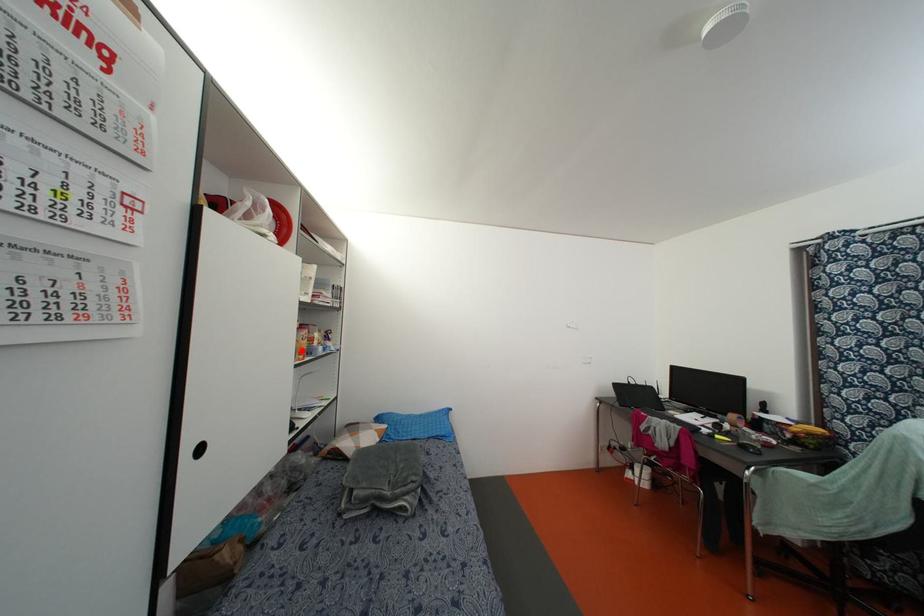
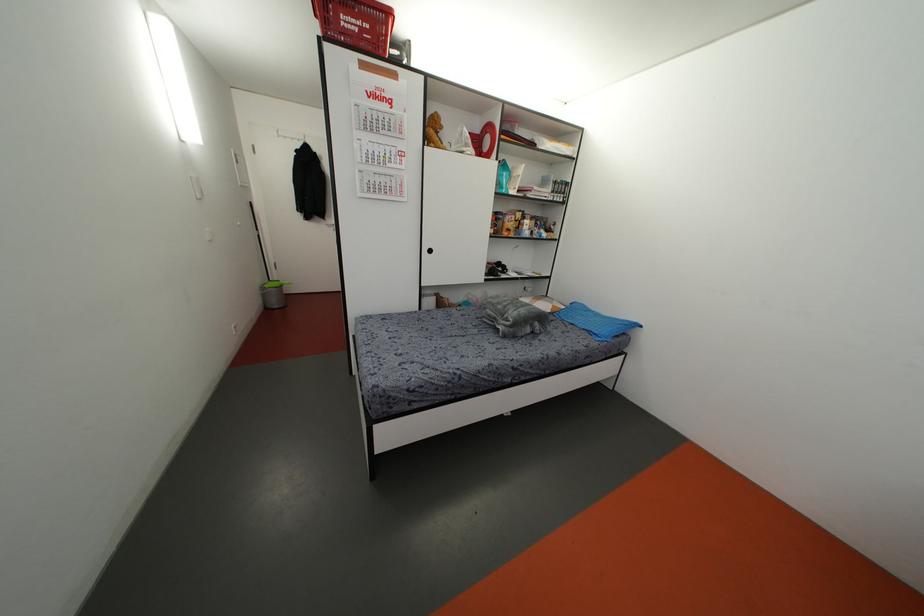
Where in the second image is the point corresponding to the highlighted location from the first image?

(507, 229)